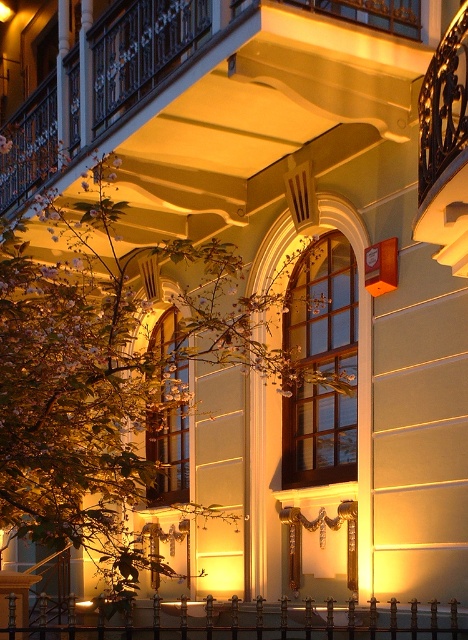
Based on the photo, can you confirm if matte glass window at center is positioned to the right of wooden window at center?

Indeed, matte glass window at center is positioned on the right side of wooden window at center.

Between matte glass window at center and wooden window at center, which one is positioned lower?

wooden window at center is below.

Who is more forward, (322, 404) or (182, 371)?

Point (322, 404) is in front.

The height and width of the screenshot is (640, 468). I want to click on matte glass window at center, so click(x=323, y=307).

Is the position of green leafy tree at center less distant than that of matte glass window at center?

Yes.

Is green leafy tree at center behind matte glass window at center?

That is False.

What do you see at coordinates (109, 376) in the screenshot?
I see `green leafy tree at center` at bounding box center [109, 376].

The width and height of the screenshot is (468, 640). Find the location of `green leafy tree at center`. green leafy tree at center is located at coordinates (109, 376).

Does green leafy tree at center have a greater height compared to black wrought iron railing at lower center?

Indeed, green leafy tree at center has a greater height compared to black wrought iron railing at lower center.

Between point (141, 540) and point (210, 620), which one is positioned behind?

Positioned behind is point (141, 540).

The image size is (468, 640). Find the location of `green leafy tree at center`. green leafy tree at center is located at coordinates (109, 376).